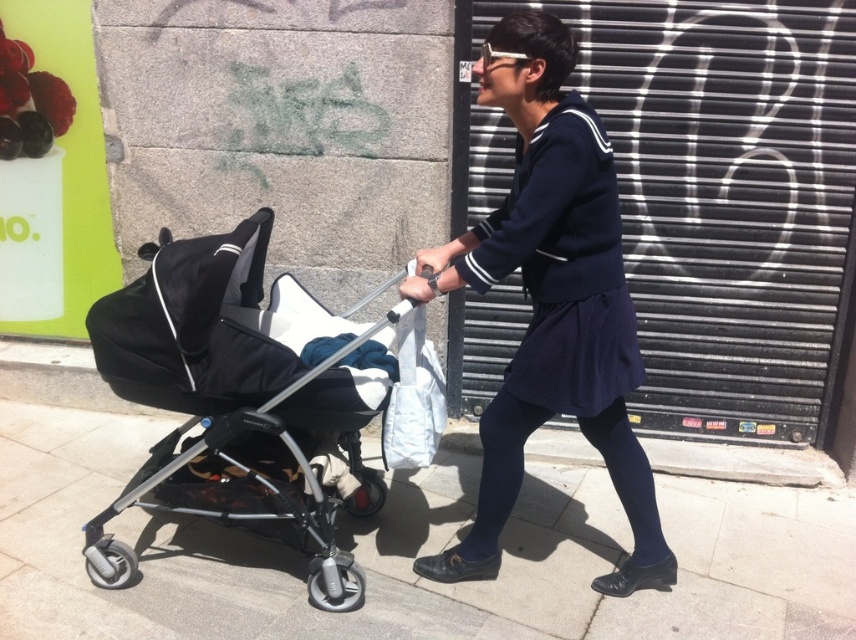
You are a pedestrian standing at the point labeled as point (412,554). You want to walk to the gray concrete pavement at center. Is your current position already at the gray concrete pavement at center?

Yes, the point (412,554) indicates the gray concrete pavement at center, so your current position is already at the gray concrete pavement at center.

You are a photographer trying to capture the scene of the person pushing the stroller. You want to ensure that both the gray concrete pavement at center and the navy blue dress at center are clearly visible in your photo. Based on their positions, which object will appear closer to the bottom of the frame?

The gray concrete pavement at center will appear closer to the bottom of the frame because it is shorter than the navy blue dress at center.